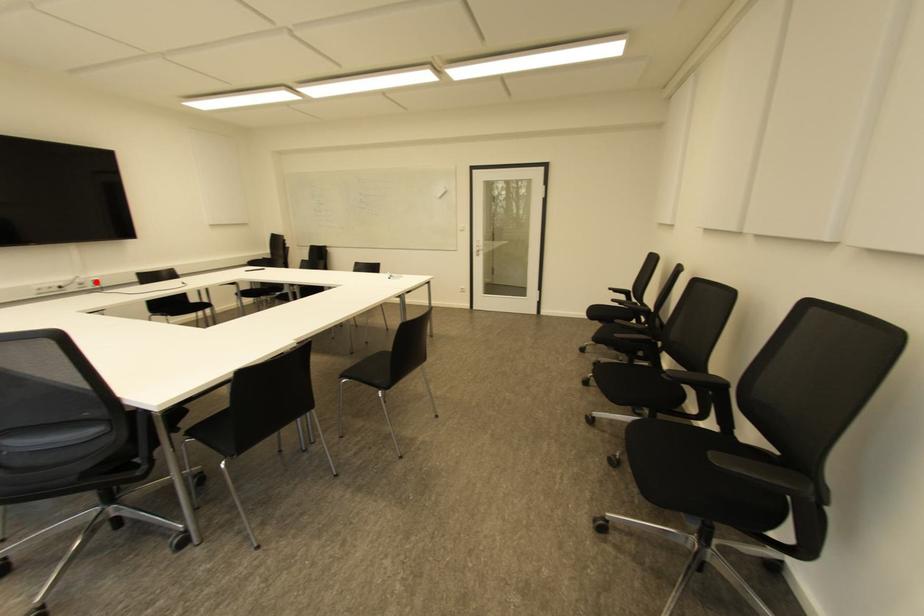
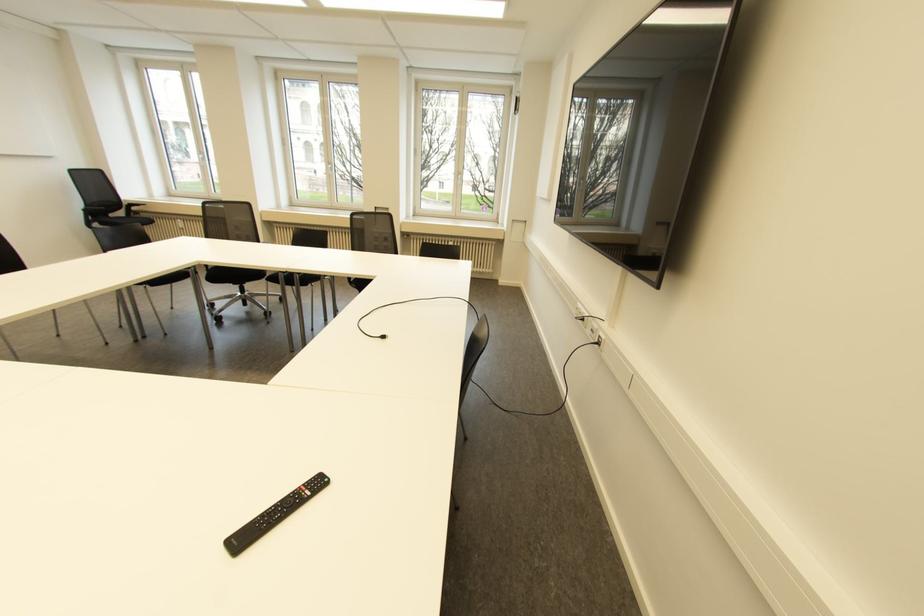
In the second image, find the point that corresponds to the highlighted location in the first image.

(598, 342)